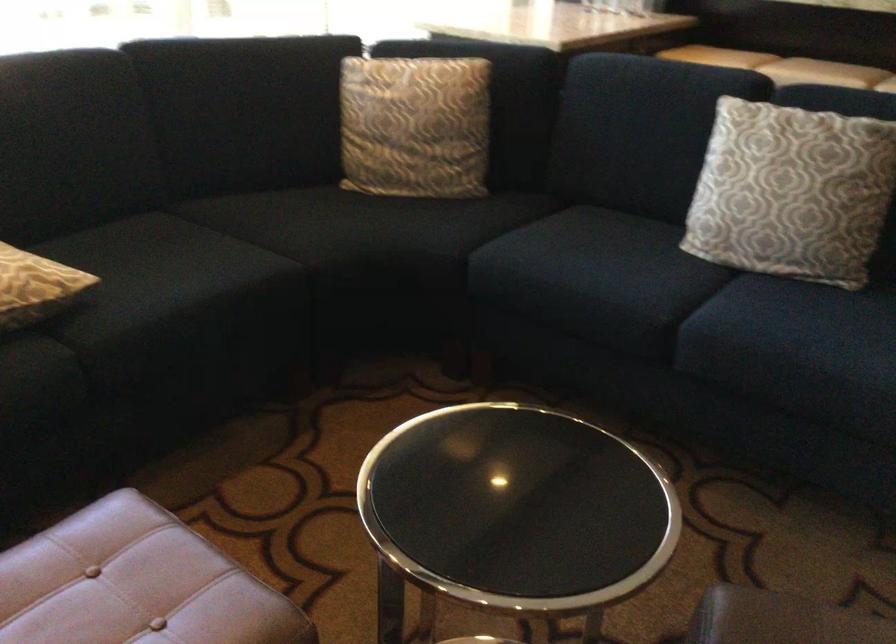
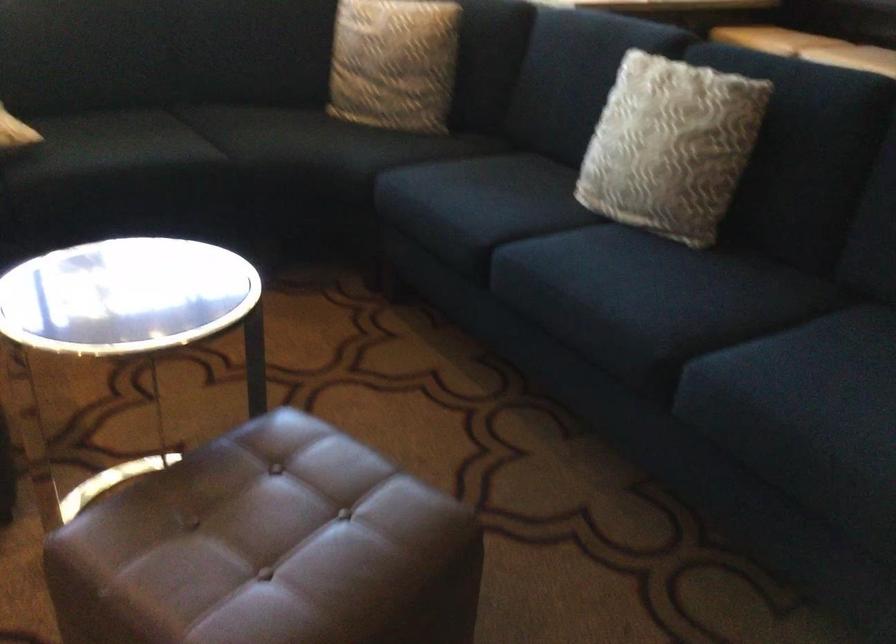
Question: What movement of the cameraman would produce the second image?

Choices:
 (A) Left
 (B) Right
 (C) Forward
 (D) Backward

Answer: (B)